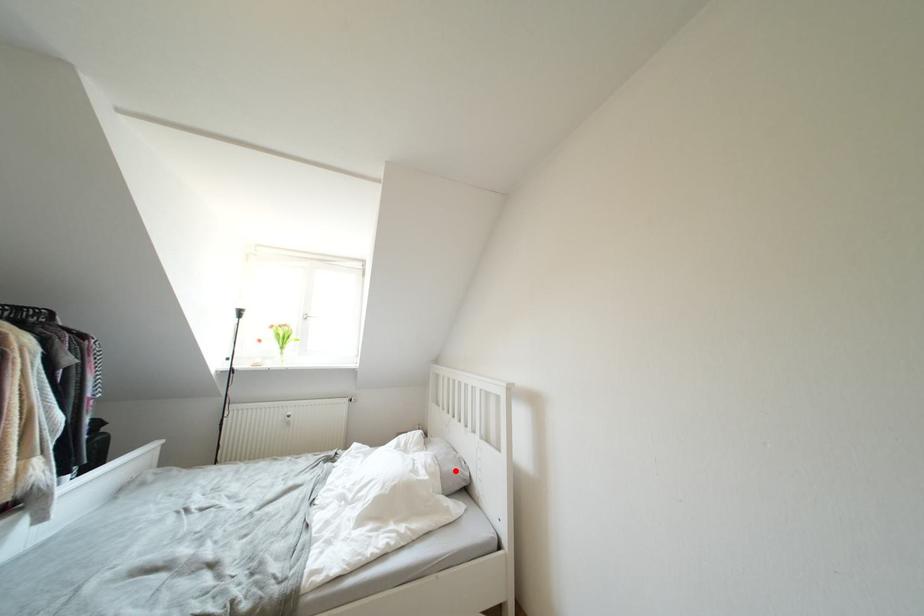
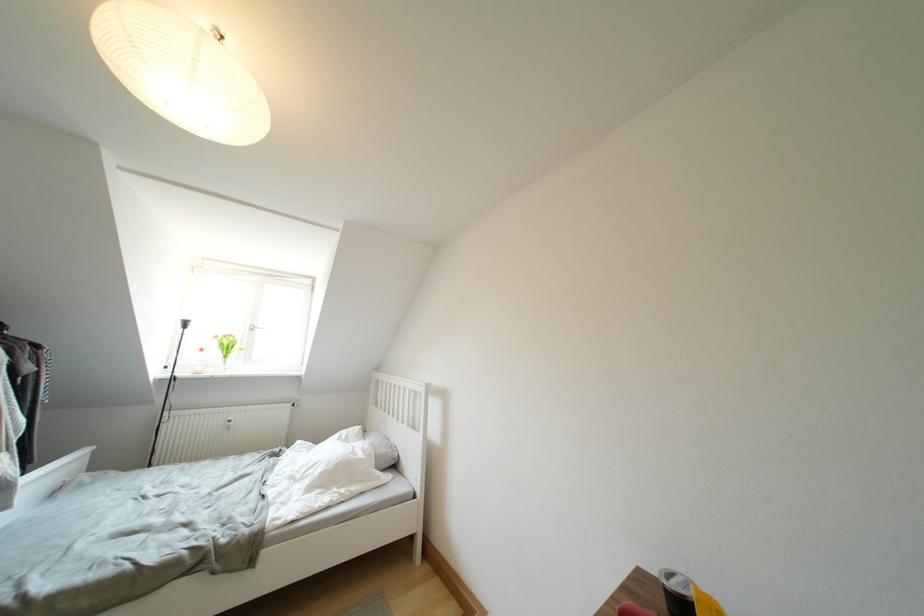
Locate, in the second image, the point that corresponds to the highlighted location in the first image.

(388, 454)